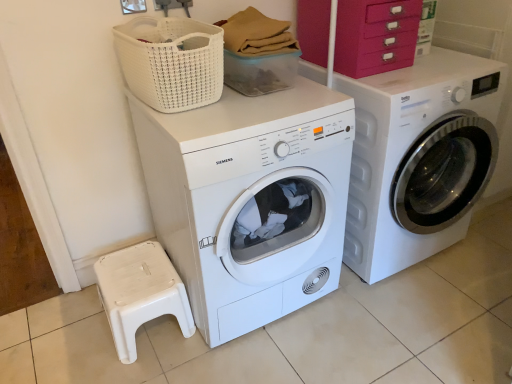
Question: Is white plastic step stool at lower left bigger than pink plastic drawers at upper right?

Choices:
 (A) no
 (B) yes

Answer: (A)

Question: Considering the relative sizes of white plastic step stool at lower left and pink plastic drawers at upper right in the image provided, is white plastic step stool at lower left smaller than pink plastic drawers at upper right?

Choices:
 (A) yes
 (B) no

Answer: (A)

Question: Is there a large distance between white plastic step stool at lower left and pink plastic drawers at upper right?

Choices:
 (A) no
 (B) yes

Answer: (B)

Question: Is white plastic step stool at lower left facing away from pink plastic drawers at upper right?

Choices:
 (A) yes
 (B) no

Answer: (B)

Question: Is white plastic step stool at lower left taller than pink plastic drawers at upper right?

Choices:
 (A) no
 (B) yes

Answer: (A)

Question: Considering the positions of point (352, 36) and point (270, 183), is point (352, 36) closer or farther from the camera than point (270, 183)?

Choices:
 (A) farther
 (B) closer

Answer: (A)

Question: In terms of height, does pink plastic drawers at upper right look taller or shorter compared to white matte washing machine at center, which is the 1th washing machine from left to right?

Choices:
 (A) tall
 (B) short

Answer: (B)

Question: From the image's perspective, is pink plastic drawers at upper right located above or below white matte washing machine at center, which is the 1th washing machine from left to right?

Choices:
 (A) below
 (B) above

Answer: (B)

Question: Considering the positions of pink plastic drawers at upper right and white matte washing machine at center, which is the 1th washing machine from left to right, in the image, is pink plastic drawers at upper right bigger or smaller than white matte washing machine at center, which is the 1th washing machine from left to right,?

Choices:
 (A) big
 (B) small

Answer: (B)

Question: From the image's perspective, is pink plastic drawers at upper right located above or below white glossy washing machine at right, which appears as the 1th washing machine when viewed from the right?

Choices:
 (A) above
 (B) below

Answer: (A)

Question: In the image, is pink plastic drawers at upper right on the left side or the right side of white glossy washing machine at right, the 2th washing machine from the left?

Choices:
 (A) right
 (B) left

Answer: (B)

Question: Is point (376, 49) closer or farther from the camera than point (424, 157)?

Choices:
 (A) farther
 (B) closer

Answer: (B)

Question: Is pink plastic drawers at upper right wider or thinner than white glossy washing machine at right, the 2th washing machine from the left?

Choices:
 (A) wide
 (B) thin

Answer: (B)

Question: Considering the relative positions of white plastic step stool at lower left and white matte washing machine at center, which is counted as the second washing machine, starting from the right, in the image provided, is white plastic step stool at lower left to the left or to the right of white matte washing machine at center, which is counted as the second washing machine, starting from the right,?

Choices:
 (A) right
 (B) left

Answer: (B)

Question: Considering the positions of point (168, 312) and point (184, 117), is point (168, 312) closer or farther from the camera than point (184, 117)?

Choices:
 (A) farther
 (B) closer

Answer: (A)